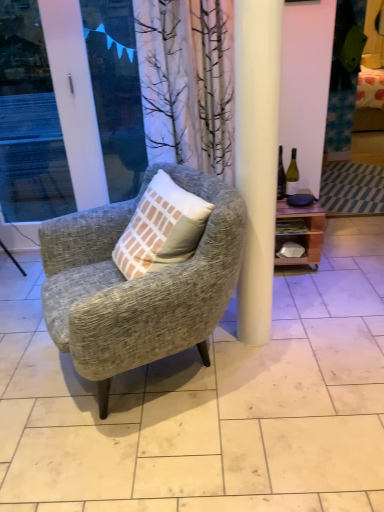
Find the location of `free space in front of wooden shelf at right`. free space in front of wooden shelf at right is located at coordinates (314, 288).